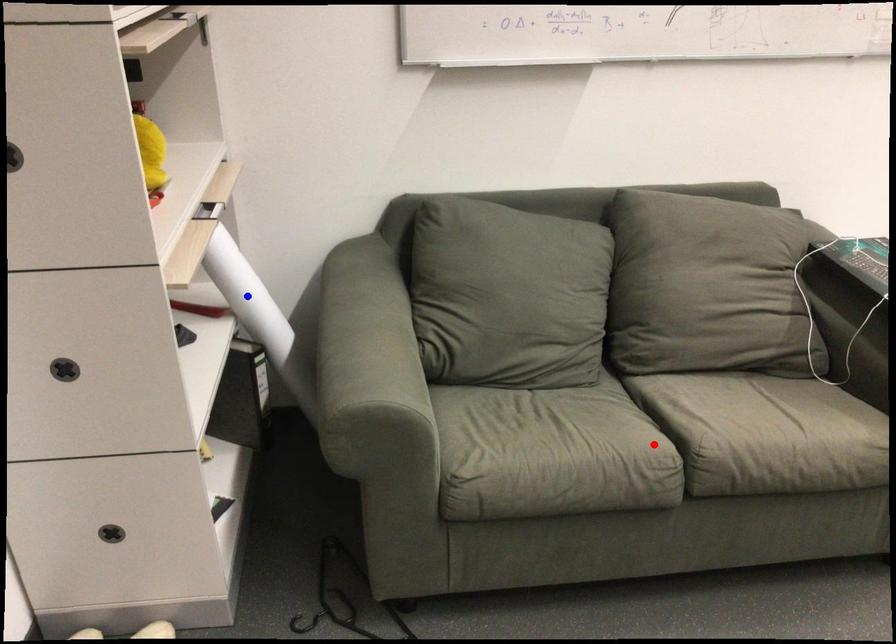
Question: In the image, two points are highlighted. Which point is nearer to the camera? Reply with the corresponding letter.

Choices:
 (A) blue point
 (B) red point

Answer: (B)